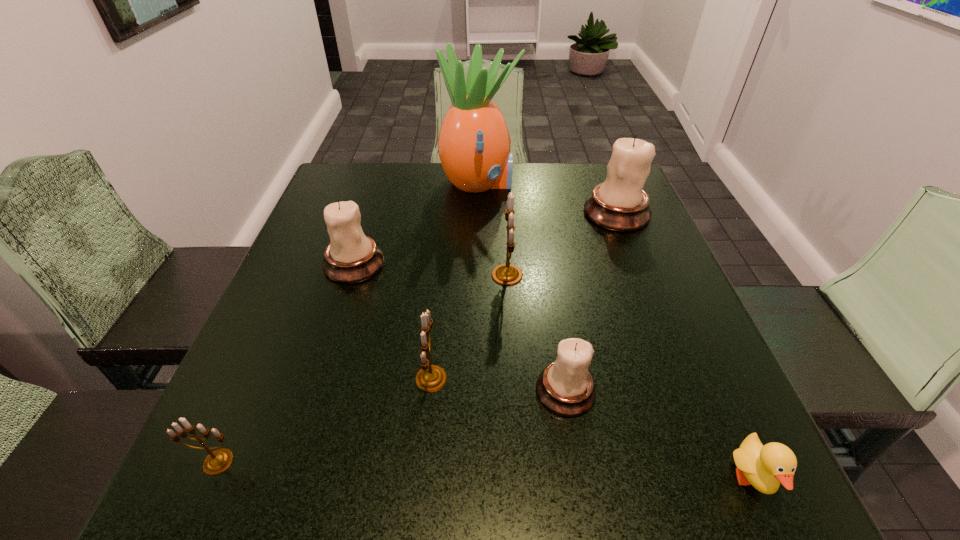
Select which object appears as the third closest to the second gold candelabrum from right to left. Please provide its 2D coordinates. Your answer should be formatted as a tuple, i.e. [(x, y)], where the tuple contains the x and y coordinates of a point satisfying the conditions above.

[(351, 257)]

Find the location of a particular element. The image size is (960, 540). candelabrum that is the second closest to the biggest gold candelabrum is located at coordinates (565, 387).

Select which candelabrum appears as the third closest to the duckling. Please provide its 2D coordinates. Your answer should be formatted as a tuple, i.e. [(x, y)], where the tuple contains the x and y coordinates of a point satisfying the conditions above.

[(507, 274)]

Identify the location of the second closest white candle holder to the duckling. (620, 204).

The image size is (960, 540). In order to click on white candle holder that is the nearest to the second nearest gold candelabrum in this screenshot , I will do `click(565, 387)`.

Locate which gold candelabrum is the second closest to the tallest object. Please provide its 2D coordinates. Your answer should be formatted as a tuple, i.e. [(x, y)], where the tuple contains the x and y coordinates of a point satisfying the conditions above.

[(430, 378)]

Identify the location of the second closest gold candelabrum to the yellow duckling. (507, 274).

Where is `free region that satisfies the following two spatial constraints: 1. on the back side of the second white candle holder from right to left; 2. on the right side of the smallest gold candelabrum`? Image resolution: width=960 pixels, height=540 pixels. free region that satisfies the following two spatial constraints: 1. on the back side of the second white candle holder from right to left; 2. on the right side of the smallest gold candelabrum is located at coordinates (250, 391).

Where is `vacant space that satisfies the following two spatial constraints: 1. at the entrance of the tallest object; 2. on the front side of the leftmost object`? vacant space that satisfies the following two spatial constraints: 1. at the entrance of the tallest object; 2. on the front side of the leftmost object is located at coordinates (477, 462).

Find the location of a particular element. Image resolution: width=960 pixels, height=540 pixels. free space that satisfies the following two spatial constraints: 1. at the entrance of the orange pineapple; 2. on the front side of the leftmost white candle holder is located at coordinates (478, 264).